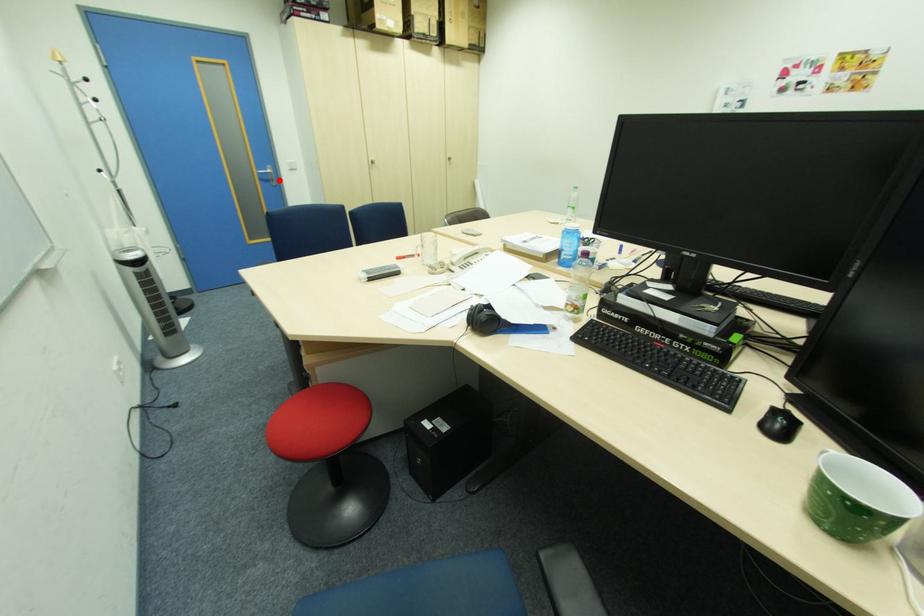
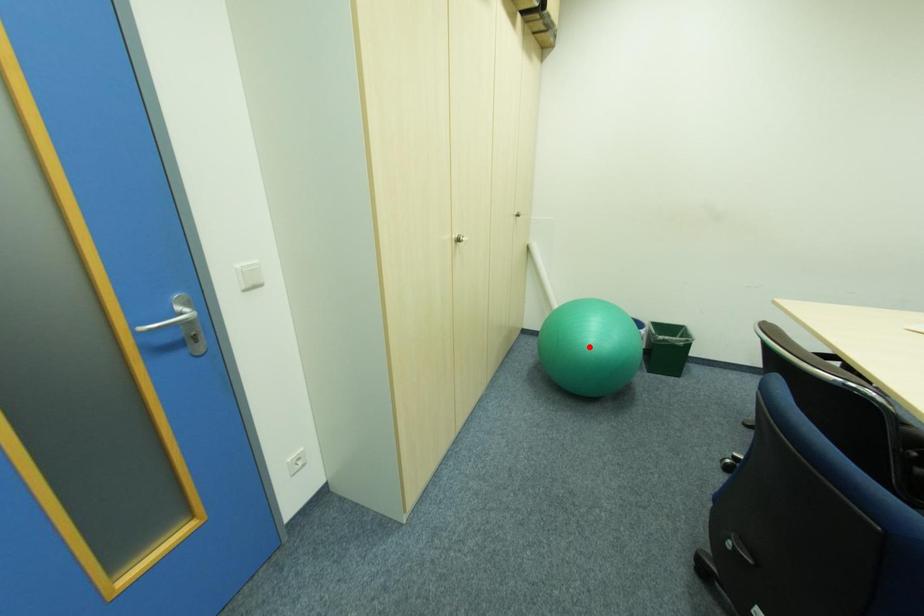
I am providing you with two images of the same scene from different viewpoints. A red point is marked on the first image and another point is marked on the second image. Does the point marked in image1 correspond to the same location as the one in image2?

No